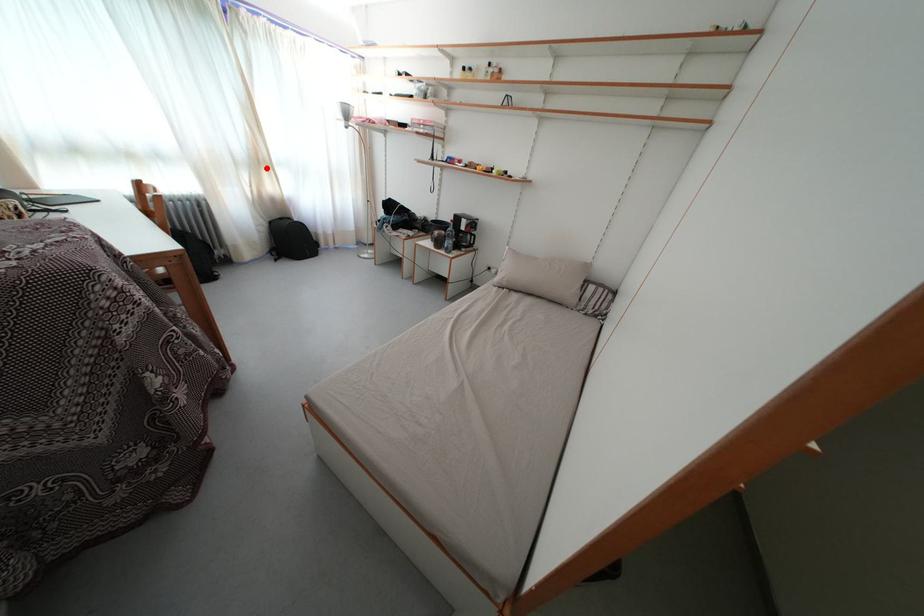
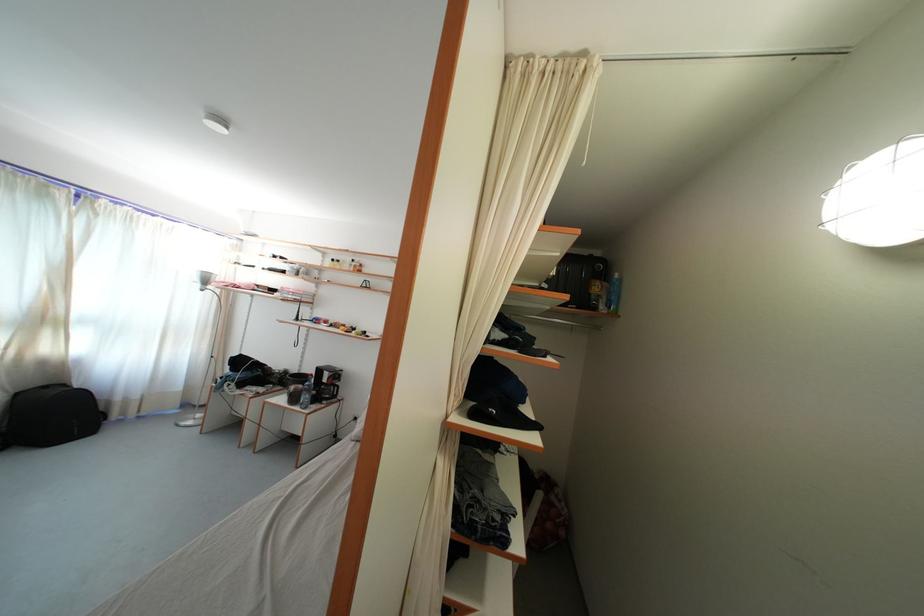
Question: I am providing you with two images of the same scene from different viewpoints. A red point is marked on the first image. Is the red point's position out of view in image 2?

Choices:
 (A) Yes
 (B) No

Answer: (B)